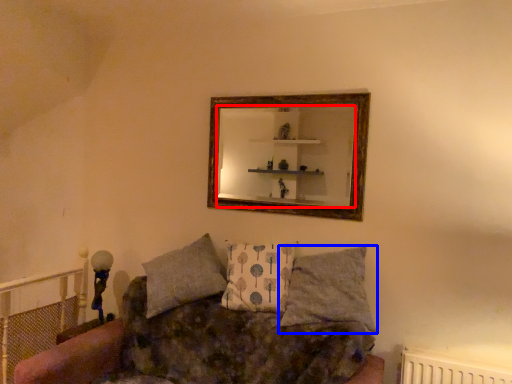
Question: Which of the following is the closest to the observer, mirror (highlighted by a red box) or pillow (highlighted by a blue box)?

Choices:
 (A) mirror
 (B) pillow

Answer: (B)